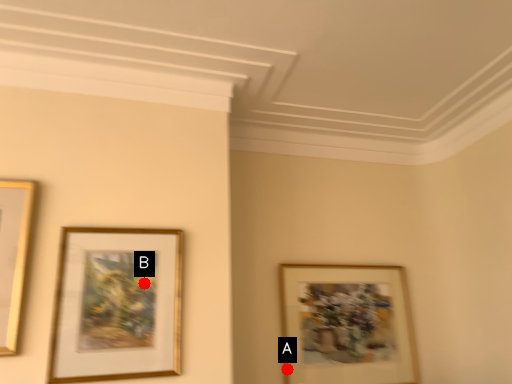
Question: Two points are circled on the image, labeled by A and B beside each circle. Which point appears closest to the camera in this image?

Choices:
 (A) A is closer
 (B) B is closer

Answer: (B)